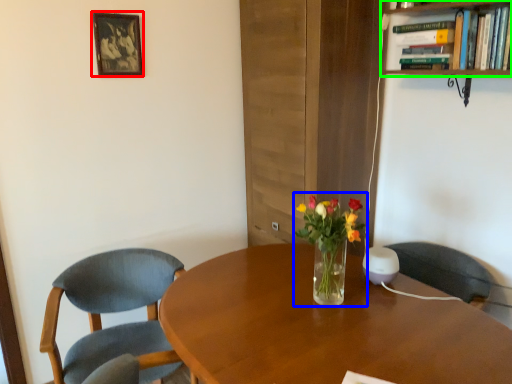
Question: Estimate the real-world distances between objects in this image. Which object is farther from picture frame (highlighted by a red box), floral arrangement (highlighted by a blue box) or bookcase (highlighted by a green box)?

Choices:
 (A) floral arrangement
 (B) bookcase

Answer: (B)